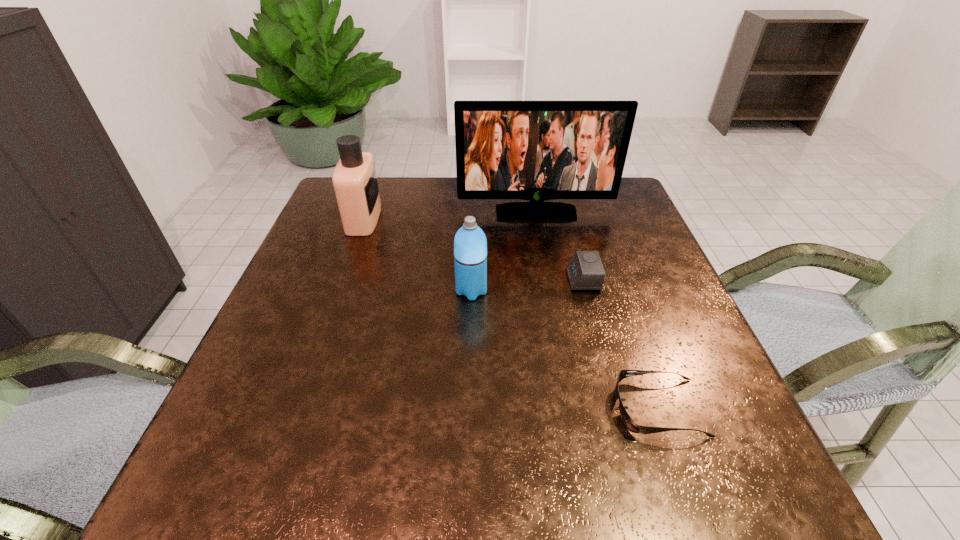
Select which object appears as the second closest to the monitor. Please provide its 2D coordinates. Your answer should be formatted as a tuple, i.e. [(x, y)], where the tuple contains the x and y coordinates of a point satisfying the conditions above.

[(355, 183)]

Point out which object is positioned as the third nearest to the fourth shortest object. Please provide its 2D coordinates. Your answer should be formatted as a tuple, i.e. [(x, y)], where the tuple contains the x and y coordinates of a point satisfying the conditions above.

[(585, 271)]

Find the location of a particular element. The height and width of the screenshot is (540, 960). vacant space that satisfies the following two spatial constraints: 1. on the front-facing side of the tallest object; 2. on the front label of the leftmost object is located at coordinates (537, 219).

The image size is (960, 540). I want to click on free spot that satisfies the following two spatial constraints: 1. on the front-facing side of the tallest object; 2. on the front label of the fourth shortest object, so click(x=537, y=219).